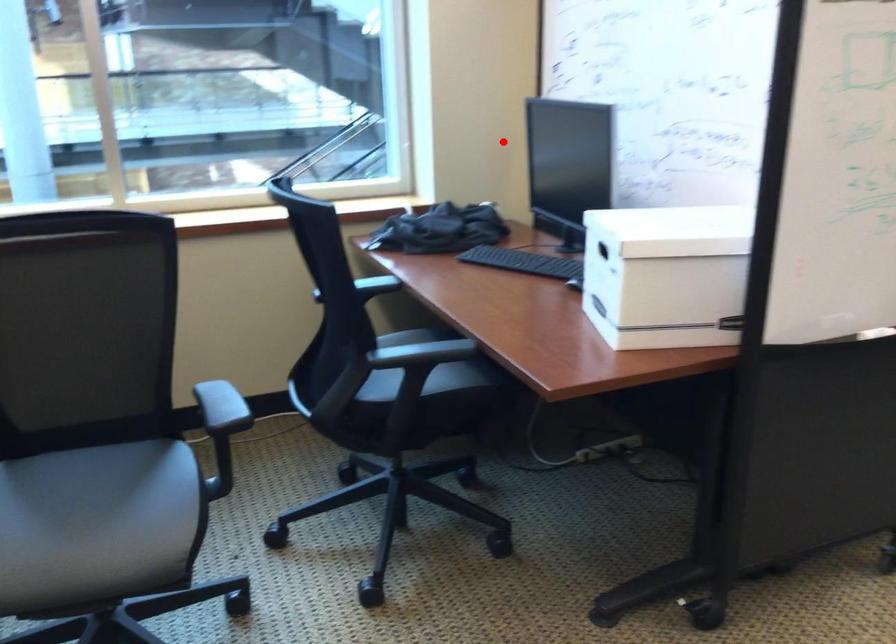
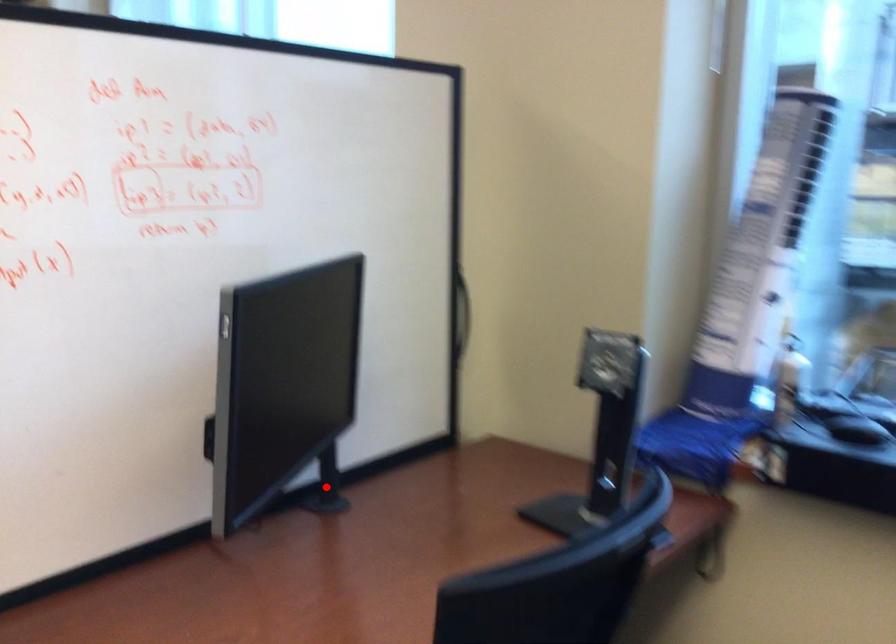
I am providing you with two images of the same scene from different viewpoints. A red point is marked on the first image and another point is marked on the second image. Does the point marked in image1 correspond to the same location as the one in image2?

No